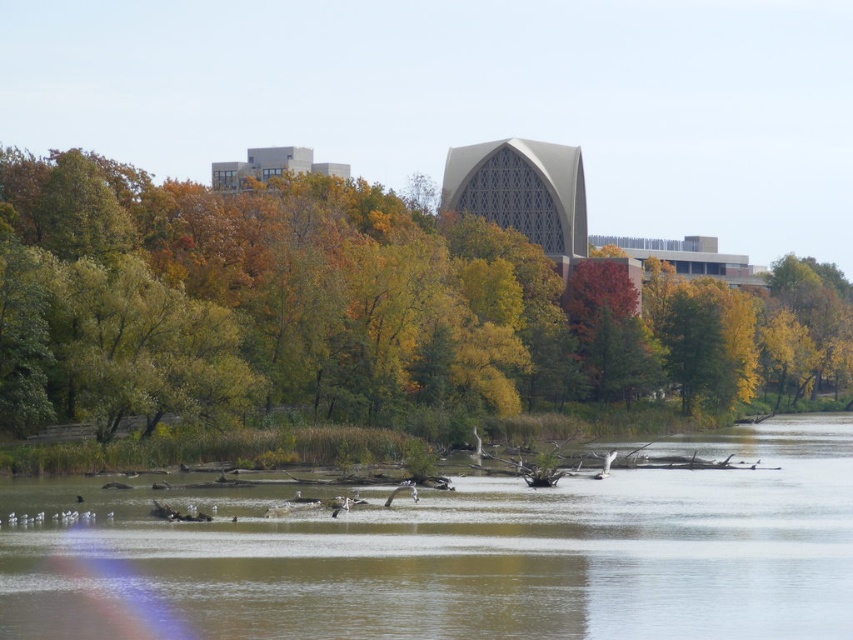
You are standing on the lakeside and want to compare the widths of the green leafy tree at center and the brown muddy water at center. Which one is wider?

The green leafy tree at center is wider than the brown muddy water at center according to the description.

You are an environmental scientist analyzing the lake ecosystem. You notice the green leafy tree at center and the brown muddy water at center. Which object occupies a greater area in the scene?

The green leafy tree at center has a larger size compared to brown muddy water at center, so it occupies a greater area in the scene.